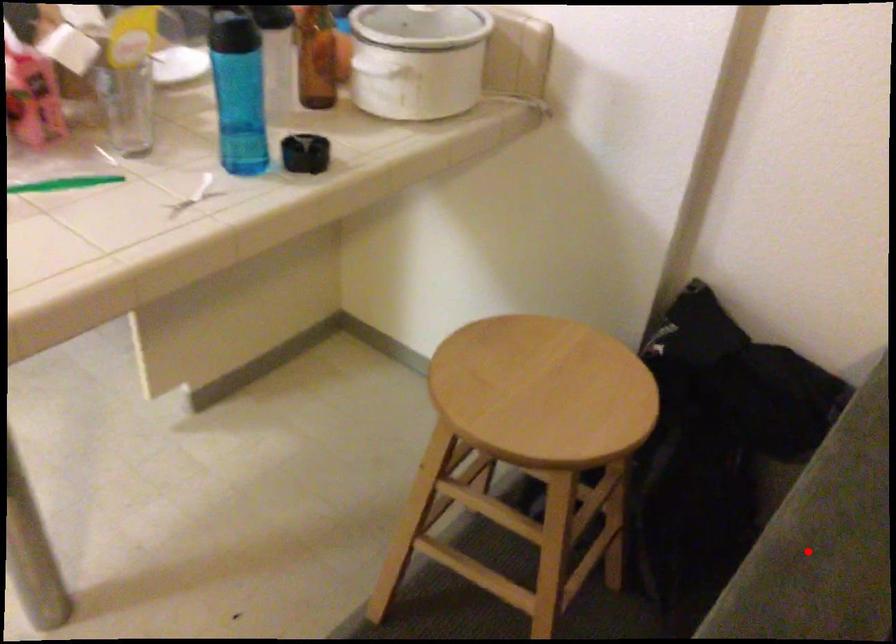
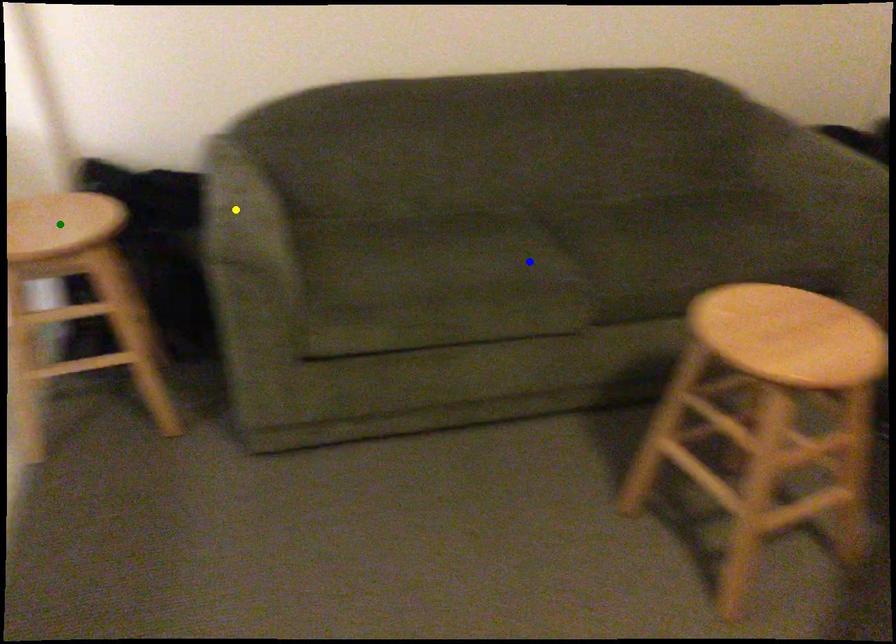
Question: I am providing you with two images of the same scene from different viewpoints. A red point is marked on the first image. You are given multiple points on the second image. In image 2, which mark is for the same physical point as the one in image 1?

Choices:
 (A) green point
 (B) yellow point
 (C) blue point

Answer: (B)